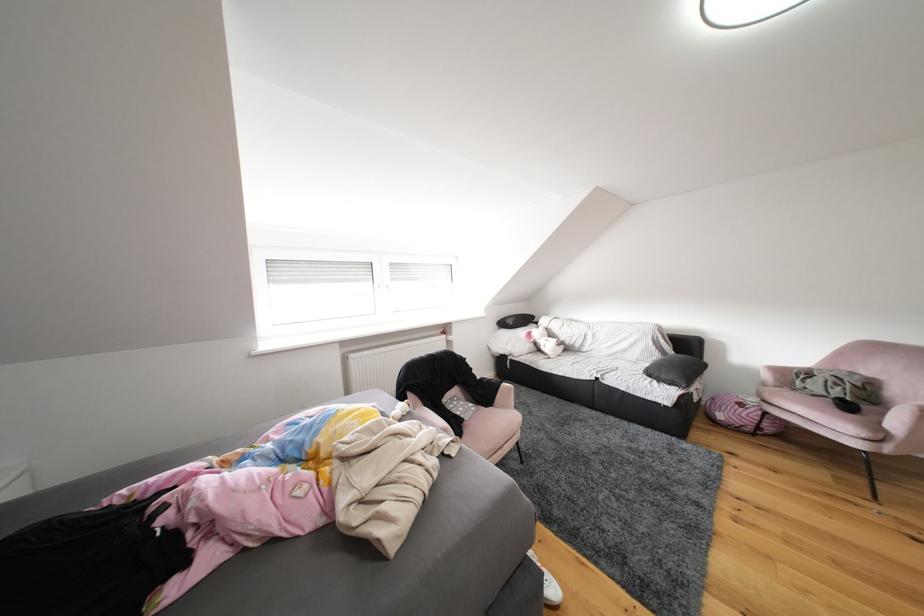
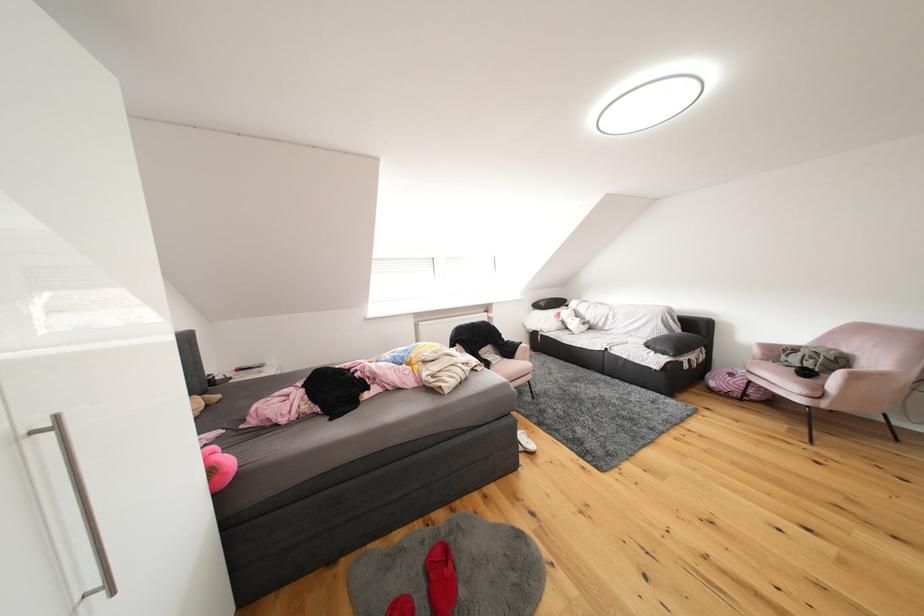
Where in the second image is the point corresponding to point (846, 432) from the first image?

(797, 392)